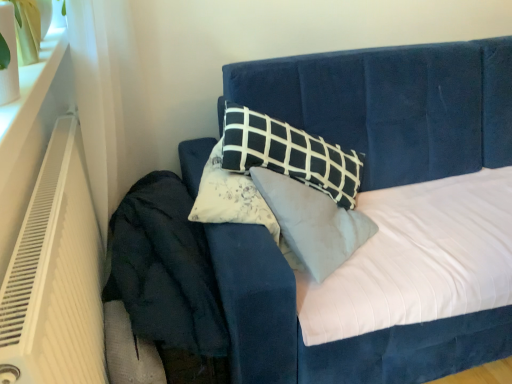
Question: Is white plastic heater at left behind dark blue velvet at lower left?

Choices:
 (A) yes
 (B) no

Answer: (B)

Question: Is dark blue velvet at lower left at the back of white plastic heater at left?

Choices:
 (A) no
 (B) yes

Answer: (B)

Question: Considering the relative sizes of white plastic heater at left and dark blue velvet at lower left in the image provided, is white plastic heater at left bigger than dark blue velvet at lower left?

Choices:
 (A) yes
 (B) no

Answer: (B)

Question: Would you say white plastic heater at left is outside dark blue velvet at lower left?

Choices:
 (A) yes
 (B) no

Answer: (A)

Question: Considering the relative sizes of white plastic heater at left and dark blue velvet at lower left in the image provided, is white plastic heater at left thinner than dark blue velvet at lower left?

Choices:
 (A) no
 (B) yes

Answer: (B)

Question: Considering the positions of point [x=148, y=175] and point [x=316, y=107], is point [x=148, y=175] closer or farther from the camera than point [x=316, y=107]?

Choices:
 (A) farther
 (B) closer

Answer: (A)

Question: From their relative heights in the image, would you say dark blue velvet at lower left is taller or shorter than velvet blue bed at center?

Choices:
 (A) short
 (B) tall

Answer: (A)

Question: Do you think dark blue velvet at lower left is within velvet blue bed at center, or outside of it?

Choices:
 (A) inside
 (B) outside

Answer: (B)

Question: From a real-world perspective, is dark blue velvet at lower left positioned above or below velvet blue bed at center?

Choices:
 (A) below
 (B) above

Answer: (A)

Question: From a real-world perspective, is white plastic heater at left physically located above or below velvet blue bed at center?

Choices:
 (A) above
 (B) below

Answer: (A)

Question: Visually, is white plastic heater at left positioned to the left or to the right of velvet blue bed at center?

Choices:
 (A) right
 (B) left

Answer: (B)

Question: Is white plastic heater at left situated inside velvet blue bed at center or outside?

Choices:
 (A) inside
 (B) outside

Answer: (B)

Question: Is white plastic heater at left wider or thinner than velvet blue bed at center?

Choices:
 (A) thin
 (B) wide

Answer: (A)

Question: From their relative heights in the image, would you say velvet blue bed at center is taller or shorter than white plastic heater at left?

Choices:
 (A) tall
 (B) short

Answer: (A)

Question: Based on their sizes in the image, would you say velvet blue bed at center is bigger or smaller than white plastic heater at left?

Choices:
 (A) big
 (B) small

Answer: (A)